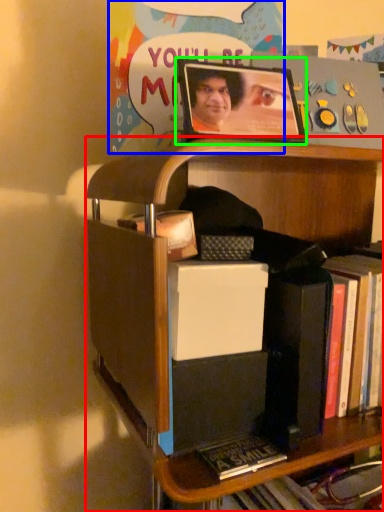
Question: Which object is the farthest from shelf (highlighted by a red box)? Choose among these: postcard (highlighted by a blue box) or picture frame (highlighted by a green box).

Choices:
 (A) postcard
 (B) picture frame

Answer: (A)